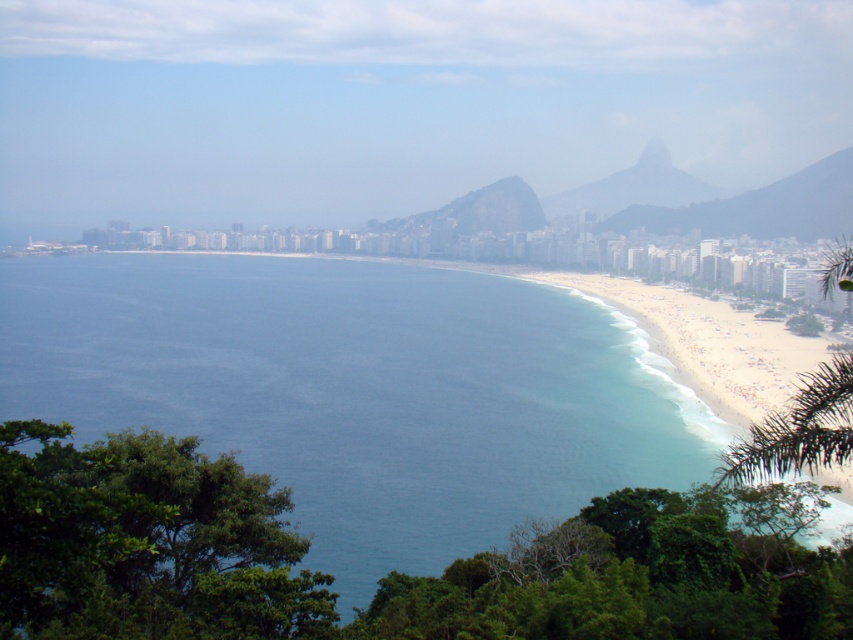
Who is positioned more to the left, blue water at center or white sand beach at center?

From the viewer's perspective, blue water at center appears more on the left side.

Image resolution: width=853 pixels, height=640 pixels. What do you see at coordinates (358, 390) in the screenshot?
I see `blue water at center` at bounding box center [358, 390].

Locate an element on the screen. Image resolution: width=853 pixels, height=640 pixels. blue water at center is located at coordinates (358, 390).

Can you confirm if blue water at center is taller than gray rocky mountain at upper right?

Yes, blue water at center is taller than gray rocky mountain at upper right.

Where is `blue water at center`? This screenshot has width=853, height=640. blue water at center is located at coordinates (358, 390).

What do you see at coordinates (358, 390) in the screenshot?
I see `blue water at center` at bounding box center [358, 390].

The height and width of the screenshot is (640, 853). Find the location of `blue water at center`. blue water at center is located at coordinates (358, 390).

Which is in front, point (666, 321) or point (508, 227)?

Point (666, 321) is more forward.

Can you confirm if white sand beach at center is taller than green textured rock at center?

Correct, white sand beach at center is much taller as green textured rock at center.

I want to click on white sand beach at center, so click(x=711, y=342).